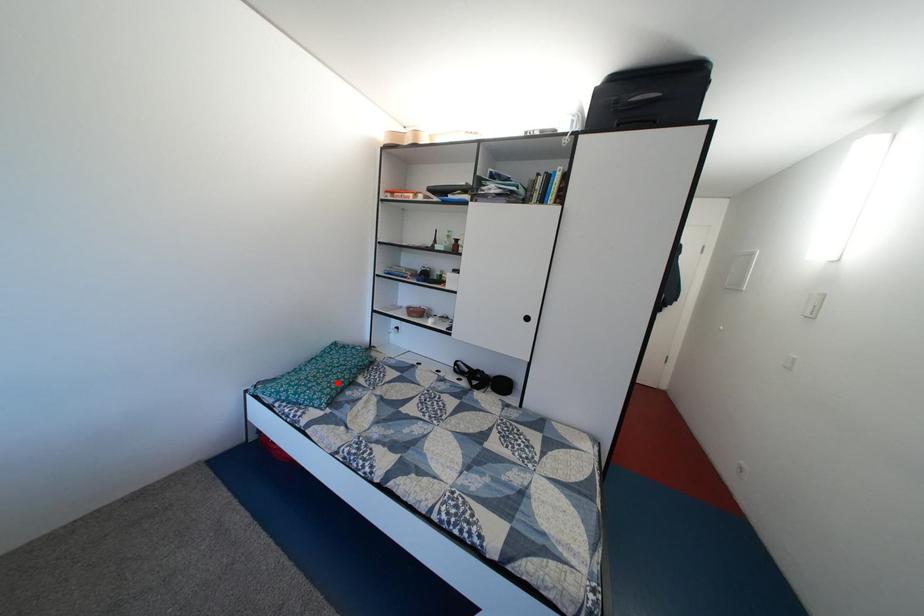
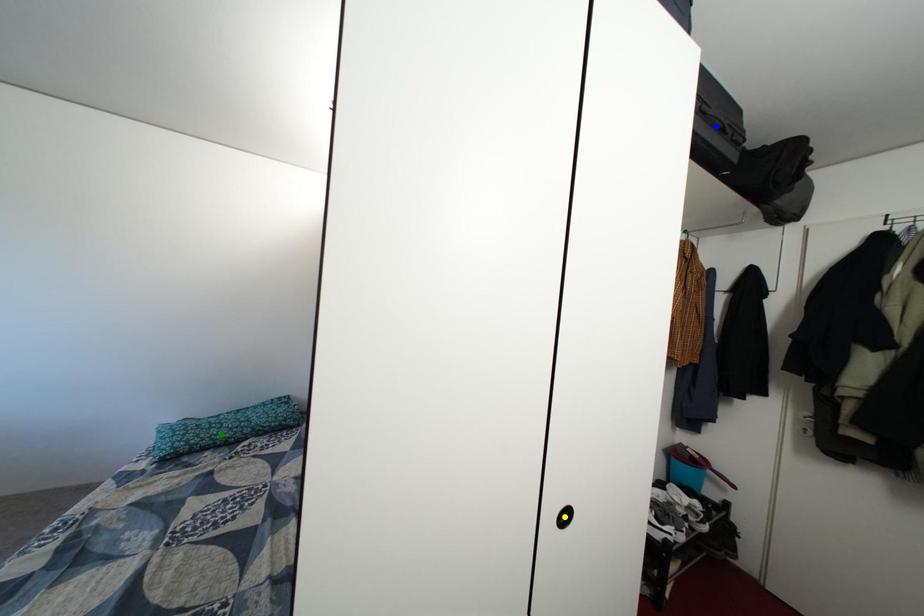
Question: I am providing you with two images of the same scene from different viewpoints. A red point is marked on the first image. You are given multiple points on the second image. Which spot in image 2 lines up with the point in image 1?

Choices:
 (A) green point
 (B) blue point
 (C) yellow point

Answer: (A)